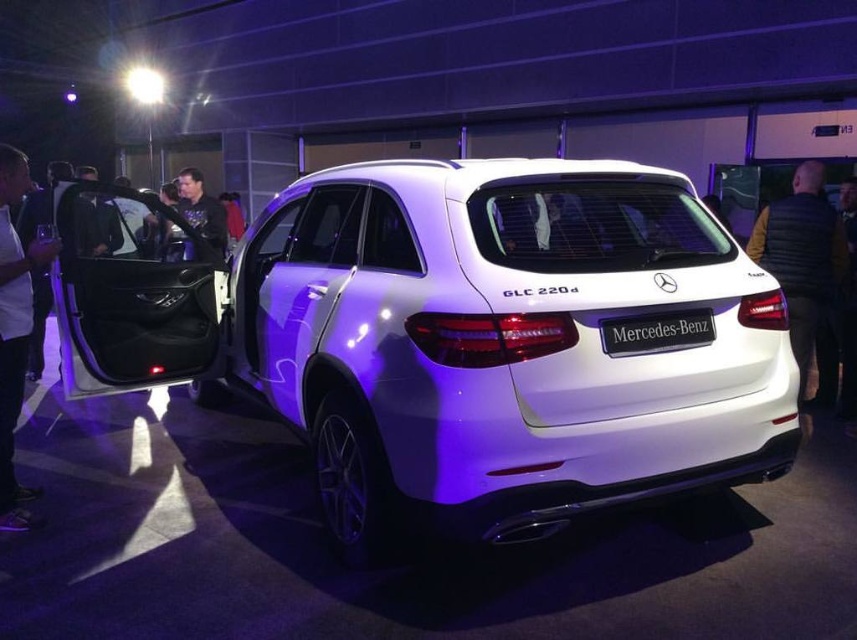
Is white glossy suv at center to the right of dark blue shirt at center from the viewer's perspective?

Correct, you'll find white glossy suv at center to the right of dark blue shirt at center.

Is point (544, 349) behind point (202, 227)?

No, (544, 349) is closer to viewer.

Where is `white glossy suv at center`? white glossy suv at center is located at coordinates (458, 340).

Does white shirt at left have a lesser height compared to black plastic mercedes-benz at center?

No, white shirt at left is not shorter than black plastic mercedes-benz at center.

Describe the element at coordinates (15, 330) in the screenshot. I see `white shirt at left` at that location.

I want to click on white shirt at left, so click(x=15, y=330).

Can you confirm if black quilted vest at rear is shorter than white shirt at left?

Correct, black quilted vest at rear is not as tall as white shirt at left.

Which is more to the right, black quilted vest at rear or white shirt at left?

Positioned to the right is black quilted vest at rear.

Image resolution: width=857 pixels, height=640 pixels. Identify the location of black quilted vest at rear. (802, 257).